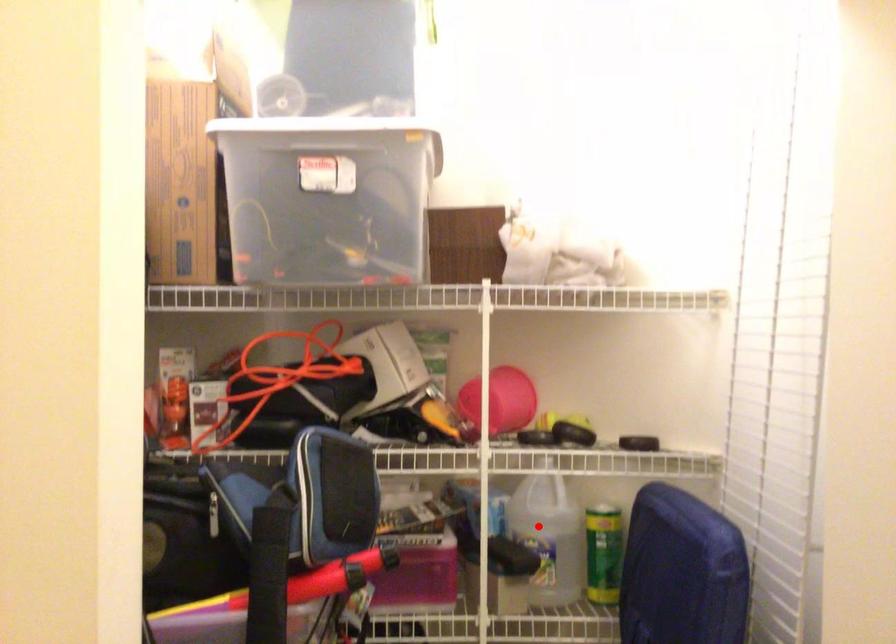
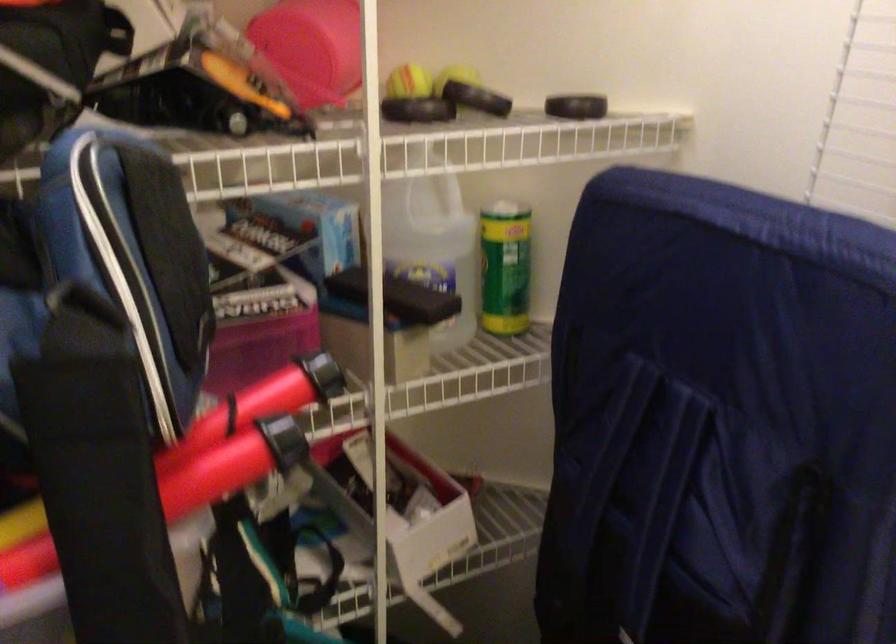
Locate, in the second image, the point that corresponds to the highlighted location in the first image.

(433, 243)